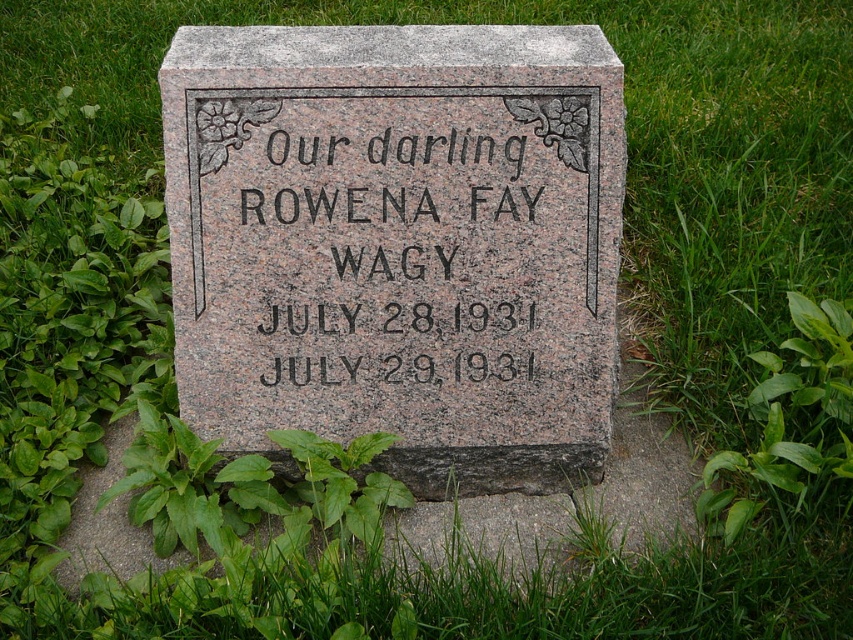
Is the position of black granite text at center less distant than that of green leafy plant at lower right?

No, black granite text at center is further to the viewer.

Between black granite text at center and green leafy plant at lower right, which one appears on the right side from the viewer's perspective?

green leafy plant at lower right is more to the right.

Is point (363, 317) farther from camera compared to point (758, 356)?

No, it is not.

Where is `black granite text at center`? The width and height of the screenshot is (853, 640). black granite text at center is located at coordinates (392, 250).

Can you confirm if granite gravestone at center is wider than green leafy plant at lower right?

Yes.

Can you confirm if granite gravestone at center is positioned to the right of green leafy plant at lower right?

In fact, granite gravestone at center is to the left of green leafy plant at lower right.

Between point (204, 433) and point (828, 346), which one is positioned behind?

Positioned behind is point (828, 346).

At what (x,y) coordinates should I click in order to perform the action: click on granite gravestone at center. Please return your answer as a coordinate pair (x, y). The width and height of the screenshot is (853, 640). Looking at the image, I should click on (399, 243).

Is granite gravestone at center to the right of black granite text at center from the viewer's perspective?

Indeed, granite gravestone at center is positioned on the right side of black granite text at center.

From the picture: Can you confirm if granite gravestone at center is smaller than black granite text at center?

No.

Does point (608, 378) come closer to viewer compared to point (434, 291)?

No, (608, 378) is further to viewer.

You are a GUI agent. You are given a task and a screenshot of the screen. Output one action in this format:
    pyautogui.click(x=<x>, y=<y>)
    Task: Click on the granite gravestone at center
    
    Given the screenshot: What is the action you would take?
    pyautogui.click(x=399, y=243)